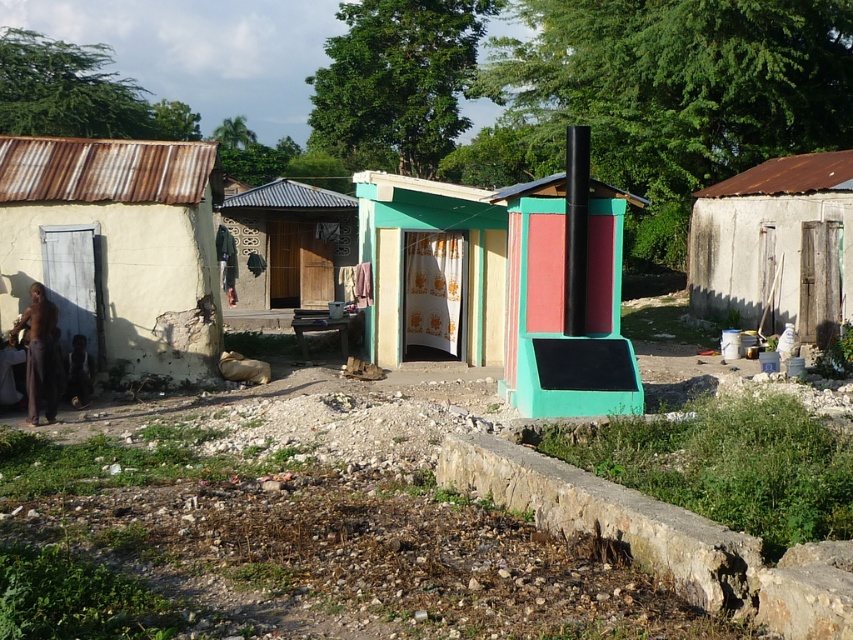
Question: Considering the real-world distances, which object is farthest from the stucco wall at center?

Choices:
 (A) white plaster wall at left
 (B) rusty metal hut at right
 (C) green painted wood door at center

Answer: (B)

Question: Which point appears closest to the camera in this image?

Choices:
 (A) (120, 240)
 (B) (308, 205)

Answer: (A)

Question: Can you confirm if white plaster wall at left is thinner than stucco wall at center?

Choices:
 (A) yes
 (B) no

Answer: (B)

Question: Can you confirm if rusty metal hut at right is positioned above green painted wood door at center?

Choices:
 (A) yes
 (B) no

Answer: (A)

Question: Is rusty metal hut at right wider than green painted wood door at center?

Choices:
 (A) yes
 (B) no

Answer: (A)

Question: Which point appears farthest from the camera in this image?

Choices:
 (A) (691, 220)
 (B) (128, 340)
 (C) (283, 298)

Answer: (C)